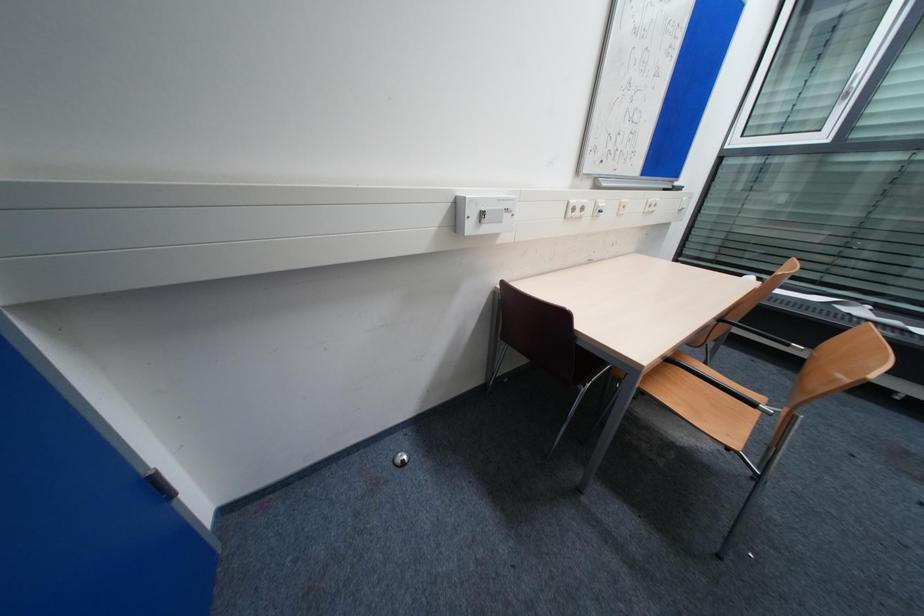
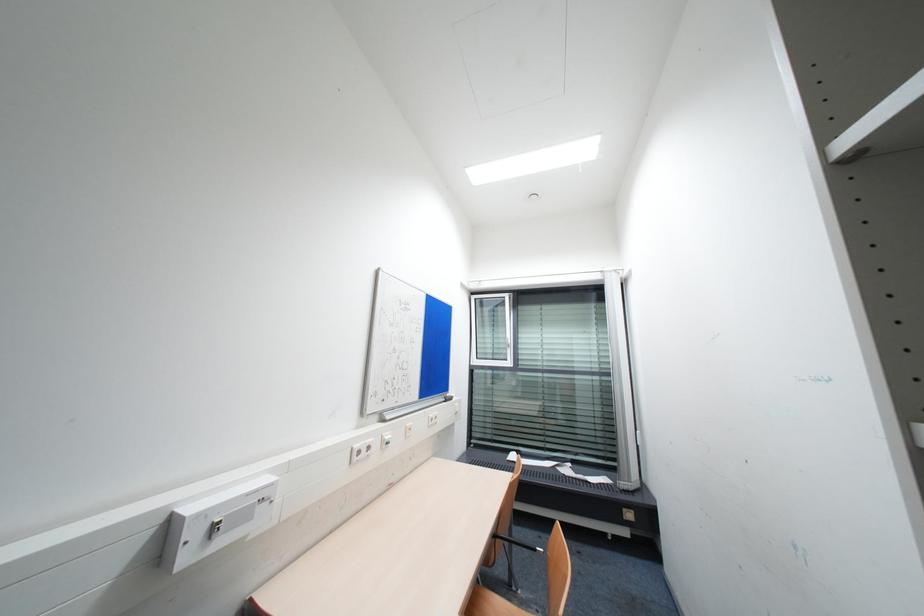
The images are taken continuously from a first-person perspective. In which direction is your viewpoint rotating?

The camera rotated toward right-up.